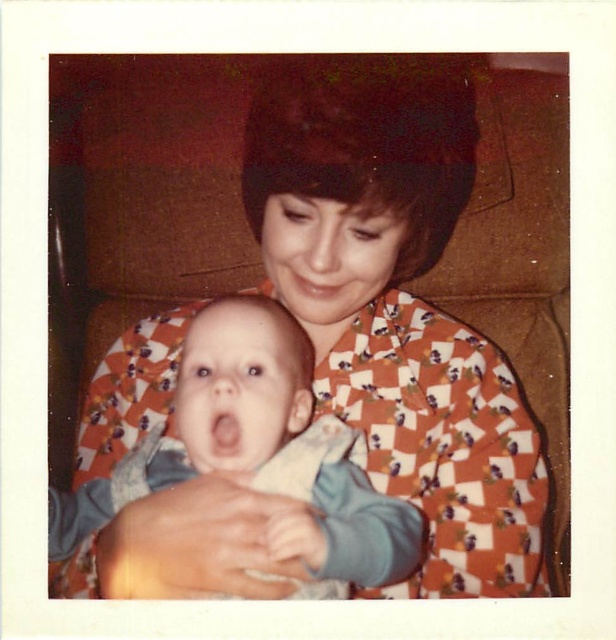
You are a photographer setting up a shoot. You have a small orange printed fabric at center and a blue cotton baby at center in the scene. The client wants to know if the fabric can fully cover the baby when placed over it. Can you confirm based on their sizes?

The orange printed fabric at center has a larger width than the blue cotton baby at center, so yes, the orange printed fabric at center can fully cover the blue cotton baby at center when placed over it.

You are a photographer trying to capture a candid shot of the blue cotton baby at center and the orange printed fabric at center. Since you want to ensure both are in the frame, can you confirm if they are positioned side by side horizontally?

The orange printed fabric at center is to the right of the blue cotton baby at center, so they are positioned side by side horizontally.

Based on the scene description, where is the orange printed fabric at center located in terms of its 2D coordinates?

The orange printed fabric at center is located at the 2D coordinates of point (359, 268).